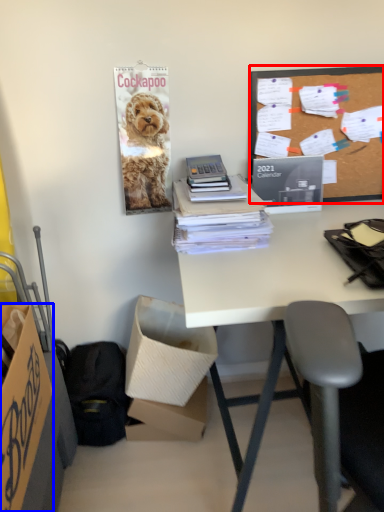
Question: Which point is further to the camera, whiteboard (highlighted by a red box) or box (highlighted by a blue box)?

Choices:
 (A) whiteboard
 (B) box

Answer: (A)